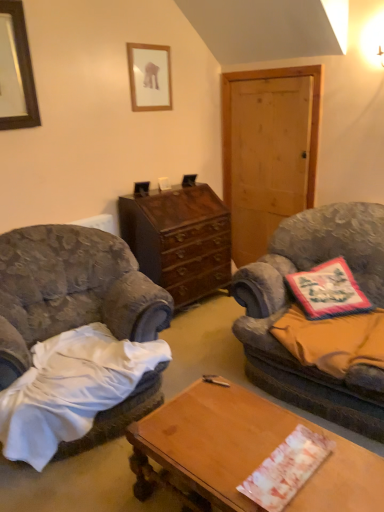
This screenshot has height=512, width=384. What are the coordinates of `vacant area on the back side of white paper at center, marked as the second sheet in a back-to-front arrangement` in the screenshot? It's located at (254, 422).